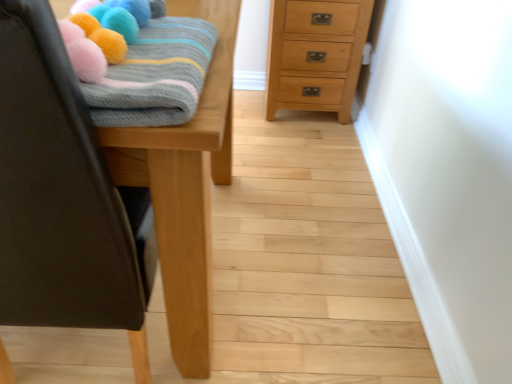
Question: From a real-world perspective, is natural wood chest of drawers at upper right positioned under knitted woolen blanket at upper left based on gravity?

Choices:
 (A) no
 (B) yes

Answer: (B)

Question: Can knitted woolen blanket at upper left be found inside natural wood chest of drawers at upper right?

Choices:
 (A) yes
 (B) no

Answer: (B)

Question: Is natural wood chest of drawers at upper right facing away from knitted woolen blanket at upper left?

Choices:
 (A) no
 (B) yes

Answer: (A)

Question: Considering the relative sizes of natural wood chest of drawers at upper right and knitted woolen blanket at upper left in the image provided, is natural wood chest of drawers at upper right shorter than knitted woolen blanket at upper left?

Choices:
 (A) yes
 (B) no

Answer: (B)

Question: From the image's perspective, is natural wood chest of drawers at upper right located above knitted woolen blanket at upper left?

Choices:
 (A) no
 (B) yes

Answer: (B)

Question: Is point (192, 71) positioned closer to the camera than point (365, 23)?

Choices:
 (A) farther
 (B) closer

Answer: (B)

Question: In terms of height, does knitted woolen blanket at upper left look taller or shorter compared to natural wood chest of drawers at upper right?

Choices:
 (A) short
 (B) tall

Answer: (A)

Question: Do you think knitted woolen blanket at upper left is within natural wood chest of drawers at upper right, or outside of it?

Choices:
 (A) inside
 (B) outside

Answer: (B)

Question: From the image's perspective, is knitted woolen blanket at upper left positioned above or below natural wood chest of drawers at upper right?

Choices:
 (A) above
 (B) below

Answer: (B)

Question: Is wooden table at left taller or shorter than knitted woolen blanket at upper left?

Choices:
 (A) short
 (B) tall

Answer: (B)

Question: From the image's perspective, is wooden table at left above or below knitted woolen blanket at upper left?

Choices:
 (A) above
 (B) below

Answer: (B)

Question: In the image, is wooden table at left positioned in front of or behind knitted woolen blanket at upper left?

Choices:
 (A) behind
 (B) front

Answer: (A)

Question: Is point (198, 362) positioned closer to the camera than point (155, 44)?

Choices:
 (A) closer
 (B) farther

Answer: (B)

Question: From the image's perspective, is wooden table at left located above or below natural wood chest of drawers at upper right?

Choices:
 (A) below
 (B) above

Answer: (A)

Question: Would you say wooden table at left is to the left or to the right of natural wood chest of drawers at upper right in the picture?

Choices:
 (A) right
 (B) left

Answer: (B)